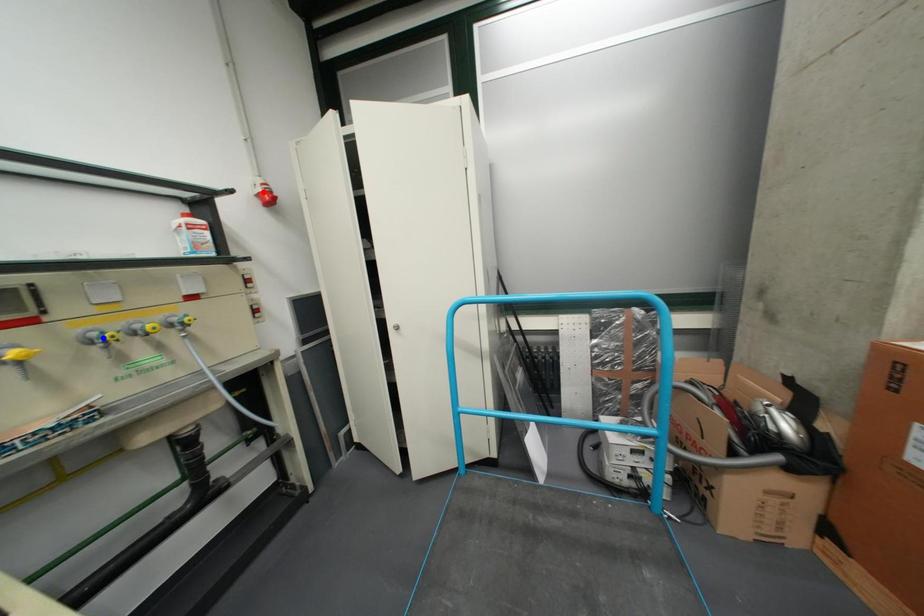
Question: In the image, two points are highlighted. Which point is nearer to the camera? Reply with the corresponding letter.

Choices:
 (A) blue point
 (B) red point

Answer: (A)